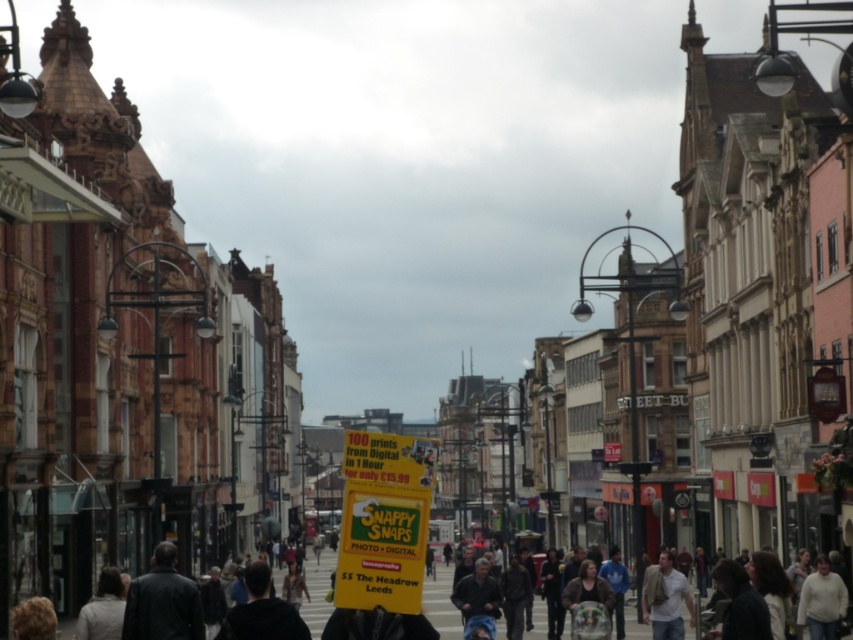
Question: Can you confirm if light beige sweater at lower right is positioned below light beige jacket at lower left?

Choices:
 (A) no
 (B) yes

Answer: (A)

Question: Can you confirm if yellow paper sign at center is positioned to the left of light beige jacket at lower left?

Choices:
 (A) no
 (B) yes

Answer: (A)

Question: Which point is farther to the camera?

Choices:
 (A) concrete pavement at lower center
 (B) light beige sweater at lower right
 (C) yellow paper sign at center
 (D) dark gray jacket at lower left

Answer: (A)

Question: Which object is the farthest from the light beige jacket at lower left?

Choices:
 (A) light beige sweater at lower right
 (B) concrete pavement at lower center
 (C) yellow paper sign at center
 (D) dark gray jacket at center

Answer: (B)

Question: Which is nearer to the dark gray jacket at lower left?

Choices:
 (A) light beige jacket at lower left
 (B) leather jacket at lower left
 (C) dark gray jacket at center
 (D) light brown leather jacket at lower right

Answer: (B)

Question: Does dark gray jacket at lower left appear on the left side of dark gray jacket at center?

Choices:
 (A) yes
 (B) no

Answer: (A)